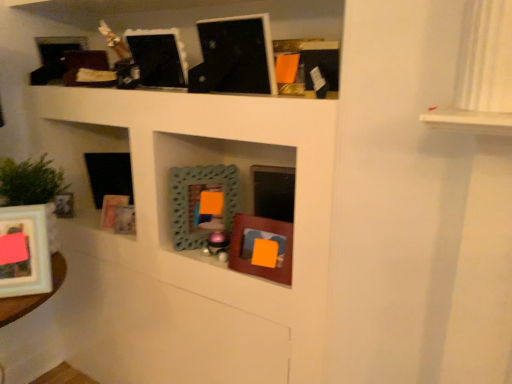
I want to click on matte black picture frame at upper center, positioned as the fourth picture frame in right-to-left order, so click(x=158, y=57).

Locate an element on the screen. matte black picture frame at left, which is the 1th picture frame from left to right is located at coordinates (64, 205).

Where is `wooden picture frame at lower left, arranged as the 5th picture frame when viewed from the left`? The height and width of the screenshot is (384, 512). wooden picture frame at lower left, arranged as the 5th picture frame when viewed from the left is located at coordinates (124, 220).

This screenshot has height=384, width=512. What do you see at coordinates (124, 220) in the screenshot? I see `wooden picture frame at lower left, arranged as the 5th picture frame when viewed from the left` at bounding box center [124, 220].

Identify the location of matte black picture frame at upper center, which is counted as the 2th picture frame, starting from the right. (234, 56).

The image size is (512, 384). Identify the location of matte white picture frame at lower left, arranged as the 2th picture frame when viewed from the left. (27, 249).

Measure the distance between point (50, 281) and camera.

1.17 meters.

This screenshot has height=384, width=512. What do you see at coordinates (109, 175) in the screenshot? I see `black matte picture frame at left, which is the seventh picture frame from right to left` at bounding box center [109, 175].

Find the location of a particular element. This screenshot has height=384, width=512. matte black picture frame at upper center, positioned as the fourth picture frame in right-to-left order is located at coordinates (158, 57).

Between point (287, 255) and point (123, 200), which one is positioned behind?

Point (123, 200)

Can you tell me how much wooden picture frame at center, which is counted as the ninth picture frame, starting from the left, and wooden frame at left, which appears as the 6th picture frame when viewed from the right, differ in facing direction?

They differ by 21.3 degrees in their facing directions.

From a real-world perspective, between wooden picture frame at center, which appears as the first picture frame when viewed from the right, and wooden frame at left, which is the fourth picture frame in left-to-right order, who is vertically lower?

From a 3D spatial view, wooden frame at left, which is the fourth picture frame in left-to-right order, is below.

Considering the sizes of matte black picture frame at upper center, the eighth picture frame from the left, and wooden picture frame at center, which is counted as the ninth picture frame, starting from the left, in the image, is matte black picture frame at upper center, the eighth picture frame from the left, bigger or smaller than wooden picture frame at center, which is counted as the ninth picture frame, starting from the left,?

Clearly, matte black picture frame at upper center, the eighth picture frame from the left, is larger in size than wooden picture frame at center, which is counted as the ninth picture frame, starting from the left.

From a real-world perspective, is matte black picture frame at upper center, which is counted as the 2th picture frame, starting from the right, above or below wooden picture frame at center, which appears as the first picture frame when viewed from the right?

Clearly, from a real-world perspective, matte black picture frame at upper center, which is counted as the 2th picture frame, starting from the right, is above wooden picture frame at center, which appears as the first picture frame when viewed from the right.

From the image's perspective, relative to wooden picture frame at center, which is counted as the ninth picture frame, starting from the left, is matte black picture frame at upper center, the eighth picture frame from the left, above or below?

Clearly, from the image's perspective, matte black picture frame at upper center, the eighth picture frame from the left, is above wooden picture frame at center, which is counted as the ninth picture frame, starting from the left.

Is matte black picture frame at upper center, the eighth picture frame from the left, outside of wooden picture frame at center, which is counted as the ninth picture frame, starting from the left?

Indeed, matte black picture frame at upper center, the eighth picture frame from the left, is completely outside wooden picture frame at center, which is counted as the ninth picture frame, starting from the left.

Which object is thinner, black matte picture frame at left, which is the seventh picture frame from right to left, or wooden picture frame at lower left, arranged as the 5th picture frame when viewed from the left?

With smaller width is wooden picture frame at lower left, arranged as the 5th picture frame when viewed from the left.

Measure the distance from black matte picture frame at left, positioned as the third picture frame in left-to-right order, to wooden picture frame at lower left, placed as the 5th picture frame when sorted from right to left.

black matte picture frame at left, positioned as the third picture frame in left-to-right order, and wooden picture frame at lower left, placed as the 5th picture frame when sorted from right to left, are 22.45 centimeters apart from each other.

Does black matte picture frame at left, positioned as the third picture frame in left-to-right order, appear on the left side of wooden picture frame at lower left, placed as the 5th picture frame when sorted from right to left?

Yes.

From the image's perspective, is black matte picture frame at left, which is the seventh picture frame from right to left, located above or below wooden picture frame at lower left, placed as the 5th picture frame when sorted from right to left?

Based on their image positions, black matte picture frame at left, which is the seventh picture frame from right to left, is located above wooden picture frame at lower left, placed as the 5th picture frame when sorted from right to left.

From a real-world perspective, is matte black picture frame at upper center, positioned as the fourth picture frame in right-to-left order, positioned above or below wooden picture frame at center, which appears as the first picture frame when viewed from the right?

From a real-world perspective, matte black picture frame at upper center, positioned as the fourth picture frame in right-to-left order, is physically above wooden picture frame at center, which appears as the first picture frame when viewed from the right.

Is point (177, 37) less distant than point (291, 261)?

No, (177, 37) is behind (291, 261).

Is matte black picture frame at upper center, the sixth picture frame in the left-to-right sequence, thinner than wooden picture frame at center, which appears as the first picture frame when viewed from the right?

No.

Looking at the image, does matte black picture frame at upper center, positioned as the fourth picture frame in right-to-left order, seem bigger or smaller compared to wooden picture frame at center, which is counted as the ninth picture frame, starting from the left?

In the image, matte black picture frame at upper center, positioned as the fourth picture frame in right-to-left order, appears to be larger than wooden picture frame at center, which is counted as the ninth picture frame, starting from the left.

Could you tell me if matte black picture frame at upper center, positioned as the fourth picture frame in right-to-left order, is facing matte black picture frame at left, which is the 1th picture frame from left to right?

No, matte black picture frame at upper center, positioned as the fourth picture frame in right-to-left order, does not turn towards matte black picture frame at left, which is the 1th picture frame from left to right.

Is matte black picture frame at upper center, positioned as the fourth picture frame in right-to-left order, bigger or smaller than matte black picture frame at left, which is the 1th picture frame from left to right?

matte black picture frame at upper center, positioned as the fourth picture frame in right-to-left order, is bigger than matte black picture frame at left, which is the 1th picture frame from left to right.

From a real-world perspective, is matte black picture frame at upper center, the sixth picture frame in the left-to-right sequence, located beneath matte black picture frame at left, which is the 1th picture frame from left to right?

No, from a real-world perspective, matte black picture frame at upper center, the sixth picture frame in the left-to-right sequence, is not beneath matte black picture frame at left, which is the 1th picture frame from left to right.

Would you say matte black picture frame at upper center, positioned as the fourth picture frame in right-to-left order, is inside or outside matte black picture frame at left, acting as the 9th picture frame starting from the right?

matte black picture frame at upper center, positioned as the fourth picture frame in right-to-left order, cannot be found inside matte black picture frame at left, acting as the 9th picture frame starting from the right.

From a real-world perspective, which is physically below, matte black picture frame at left, which is the 1th picture frame from left to right, or teal textured mirror at center, which is the 3th picture frame from right to left?

matte black picture frame at left, which is the 1th picture frame from left to right.

Is matte black picture frame at left, which is the 1th picture frame from left to right, not near teal textured mirror at center, acting as the 7th picture frame starting from the left?

No, matte black picture frame at left, which is the 1th picture frame from left to right, is in close proximity to teal textured mirror at center, acting as the 7th picture frame starting from the left.

From the image's perspective, is matte black picture frame at left, acting as the 9th picture frame starting from the right, positioned above or below teal textured mirror at center, which is the 3th picture frame from right to left?

matte black picture frame at left, acting as the 9th picture frame starting from the right, is below teal textured mirror at center, which is the 3th picture frame from right to left.

From a real-world perspective, which picture frame is the 5th one above the matte black picture frame at left, which is the 1th picture frame from left to right? Please provide its 2D coordinates.

[(199, 200)]

Is matte black picture frame at left, acting as the 9th picture frame starting from the right, positioned with its back to matte black picture frame at upper center, the sixth picture frame in the left-to-right sequence?

No, matte black picture frame at upper center, the sixth picture frame in the left-to-right sequence, is not at the back of matte black picture frame at left, acting as the 9th picture frame starting from the right.

From their relative heights in the image, would you say matte black picture frame at left, acting as the 9th picture frame starting from the right, is taller or shorter than matte black picture frame at upper center, positioned as the fourth picture frame in right-to-left order?

Considering their sizes, matte black picture frame at left, acting as the 9th picture frame starting from the right, has less height than matte black picture frame at upper center, positioned as the fourth picture frame in right-to-left order.

Is matte black picture frame at left, acting as the 9th picture frame starting from the right, in contact with matte black picture frame at upper center, the sixth picture frame in the left-to-right sequence?

No, matte black picture frame at left, acting as the 9th picture frame starting from the right, is not with matte black picture frame at upper center, the sixth picture frame in the left-to-right sequence.

The image size is (512, 384). In order to click on the 5th picture frame counting from the left of the wooden picture frame at center, which is counted as the ninth picture frame, starting from the left in this screenshot , I will do `click(112, 209)`.

Where is `the 5th picture frame above the wooden picture frame at center, which is counted as the ninth picture frame, starting from the left (from a real-world perspective)`? The height and width of the screenshot is (384, 512). the 5th picture frame above the wooden picture frame at center, which is counted as the ninth picture frame, starting from the left (from a real-world perspective) is located at coordinates (234, 56).

Based on their spatial positions, is matte black picture frame at upper center, the eighth picture frame from the left, or wooden picture frame at lower left, placed as the 5th picture frame when sorted from right to left, closer to wooden frame at left, which appears as the 6th picture frame when viewed from the right?

wooden picture frame at lower left, placed as the 5th picture frame when sorted from right to left.

Considering their positions, is matte black picture frame at upper center, which is counted as the 2th picture frame, starting from the right, positioned closer to wooden picture frame at center, which is counted as the ninth picture frame, starting from the left, than matte black picture frame at upper center, positioned as the fourth picture frame in right-to-left order?

Based on the image, matte black picture frame at upper center, which is counted as the 2th picture frame, starting from the right, appears to be nearer to wooden picture frame at center, which is counted as the ninth picture frame, starting from the left.

Based on their spatial positions, is matte black picture frame at upper center, which is counted as the 2th picture frame, starting from the right, or wooden frame at left, which appears as the 6th picture frame when viewed from the right, further from matte black picture frame at upper center, the sixth picture frame in the left-to-right sequence?

Among the two, wooden frame at left, which appears as the 6th picture frame when viewed from the right, is located further to matte black picture frame at upper center, the sixth picture frame in the left-to-right sequence.

From the image, which object appears to be nearer to black matte picture frame at left, which is the seventh picture frame from right to left, wooden frame at left, which is the fourth picture frame in left-to-right order, or matte white picture frame at lower left, arranged as the 2th picture frame when viewed from the left?

Among the two, wooden frame at left, which is the fourth picture frame in left-to-right order, is located nearer to black matte picture frame at left, which is the seventh picture frame from right to left.

When comparing their distances from black matte picture frame at left, positioned as the third picture frame in left-to-right order, does matte black picture frame at upper center, the eighth picture frame from the left, or wooden frame at left, which appears as the 6th picture frame when viewed from the right, seem further?

Based on the image, matte black picture frame at upper center, the eighth picture frame from the left, appears to be further to black matte picture frame at left, positioned as the third picture frame in left-to-right order.

Which object lies further to the anchor point matte black picture frame at left, which is the 1th picture frame from left to right, wooden picture frame at center, which appears as the first picture frame when viewed from the right, or wooden picture frame at lower left, placed as the 5th picture frame when sorted from right to left?

The object further to matte black picture frame at left, which is the 1th picture frame from left to right, is wooden picture frame at center, which appears as the first picture frame when viewed from the right.

Estimate the real-world distances between objects in this image. Which object is further from wooden picture frame at lower left, placed as the 5th picture frame when sorted from right to left, wooden picture frame at center, which is counted as the ninth picture frame, starting from the left, or matte black picture frame at upper center, positioned as the fourth picture frame in right-to-left order?

matte black picture frame at upper center, positioned as the fourth picture frame in right-to-left order, lies further to wooden picture frame at lower left, placed as the 5th picture frame when sorted from right to left, than the other object.

When comparing their distances from wooden picture frame at lower left, placed as the 5th picture frame when sorted from right to left, does matte black picture frame at left, which is the 1th picture frame from left to right, or teal textured mirror at center, which is the 3th picture frame from right to left, seem closer?

Based on the image, teal textured mirror at center, which is the 3th picture frame from right to left, appears to be nearer to wooden picture frame at lower left, placed as the 5th picture frame when sorted from right to left.